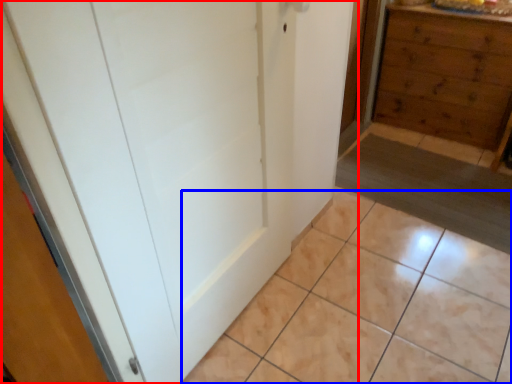
Question: Which point is further to the camera, door (highlighted by a red box) or ceramic tile (highlighted by a blue box)?

Choices:
 (A) door
 (B) ceramic tile

Answer: (B)